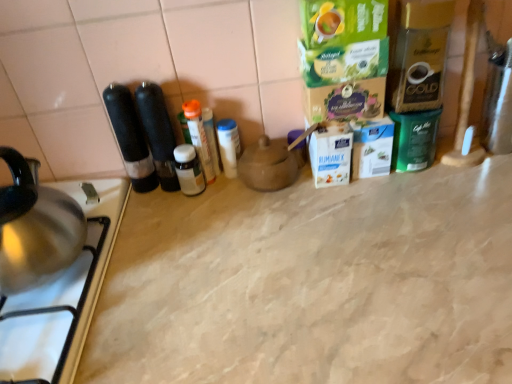
Locate an element on the screen. The image size is (512, 384). vacant region to the left of matte brown teapot at center is located at coordinates (185, 215).